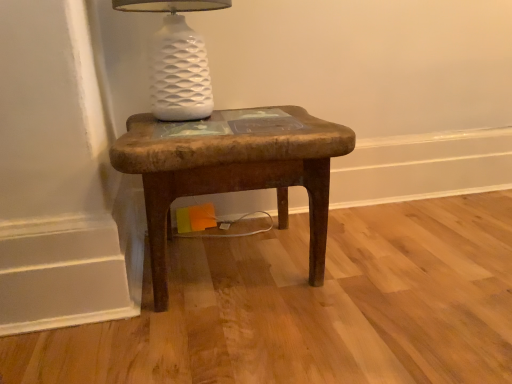
Locate an element on the screen. The image size is (512, 384). vacant space in front of white ceramic lamp at upper center is located at coordinates (195, 138).